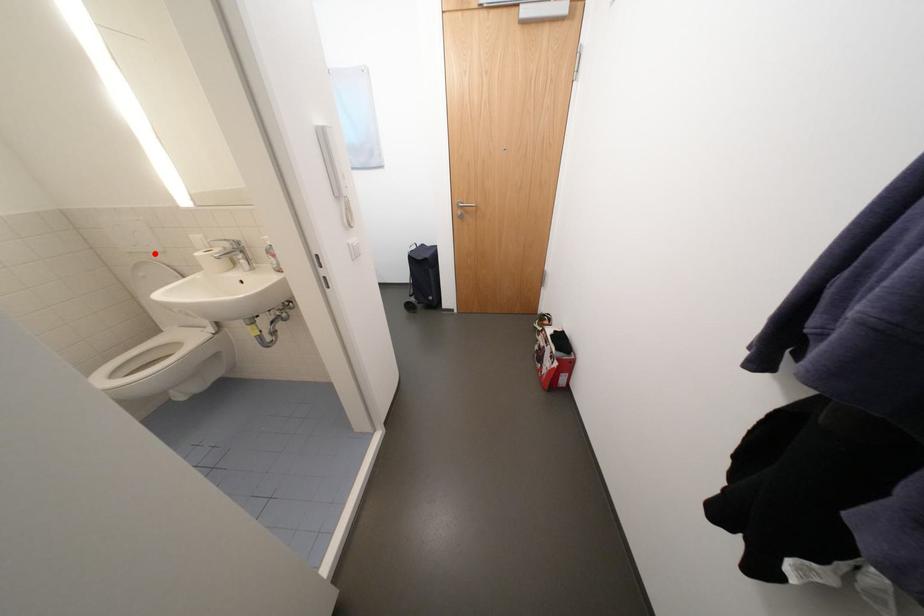
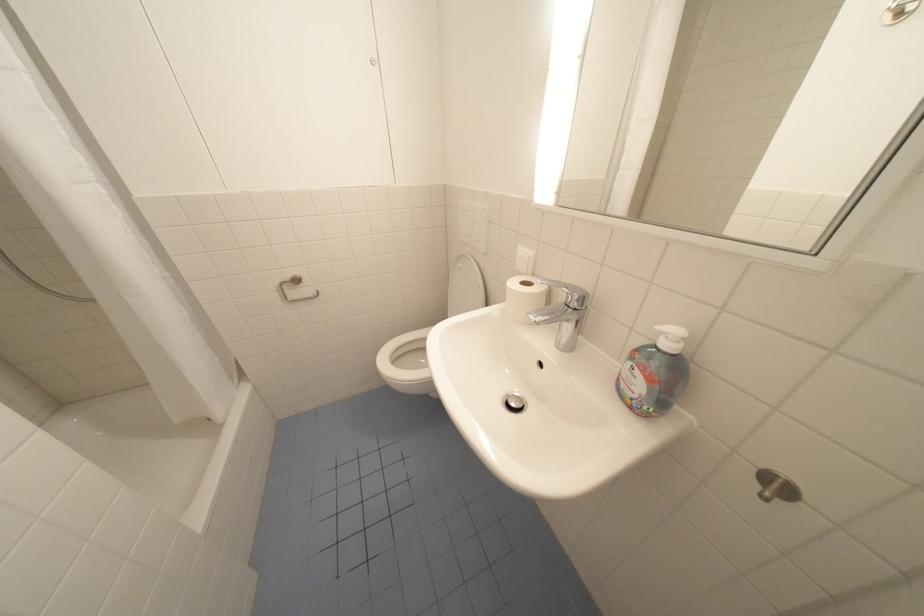
Locate, in the second image, the point that corresponds to the highlighted location in the first image.

(480, 248)